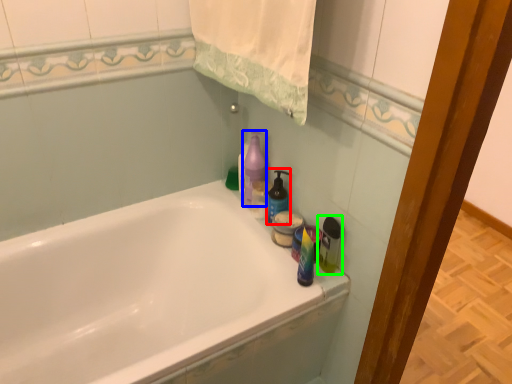
Question: Considering the real-world distances, which object is closest to cleaning product (highlighted by a red box)? cleaning product (highlighted by a blue box) or cleaning product (highlighted by a green box).

Choices:
 (A) cleaning product
 (B) cleaning product

Answer: (A)